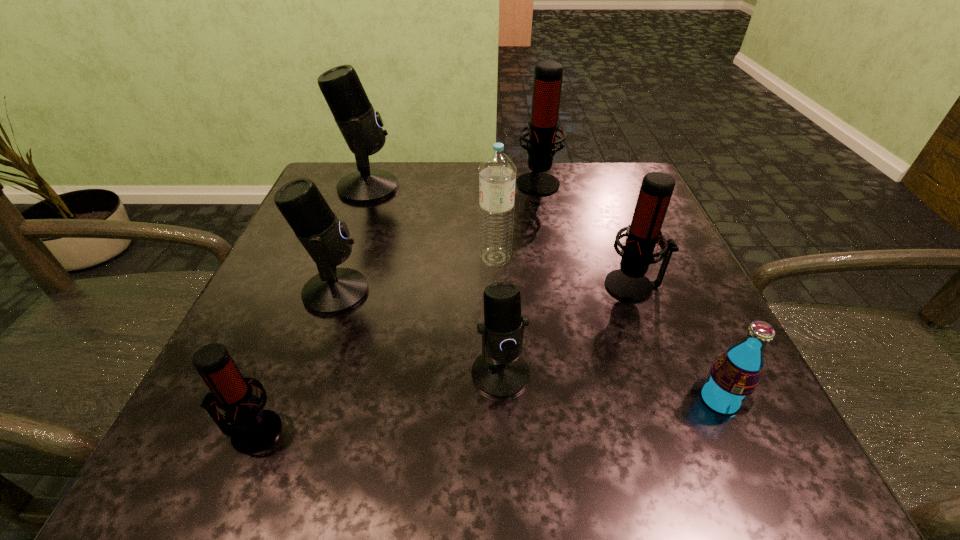
Where is `the farthest red microphone`? the farthest red microphone is located at coordinates point(548,75).

Identify the location of the biggest red microphone. (548, 75).

The width and height of the screenshot is (960, 540). I want to click on the farthest black microphone, so click(361, 127).

This screenshot has width=960, height=540. What are the coordinates of `water bottle` in the screenshot? It's located at (497, 171).

At what (x,y) coordinates should I click in order to perform the action: click on the second smallest black microphone. Please return your answer as a coordinate pair (x, y). This screenshot has width=960, height=540. Looking at the image, I should click on (333, 290).

Find the location of a particular element. The height and width of the screenshot is (540, 960). the second nearest red microphone is located at coordinates (628, 283).

Where is `the rightmost microphone`? This screenshot has width=960, height=540. the rightmost microphone is located at coordinates (628, 283).

At what (x,y) coordinates should I click in order to perform the action: click on the smallest black microphone. Please return your answer as a coordinate pair (x, y). Looking at the image, I should click on (501, 372).

Find the location of a particular element. The image size is (960, 540). the fourth microphone from left to right is located at coordinates (501, 372).

Identify the location of the smallest red microphone. This screenshot has height=540, width=960. (252, 429).